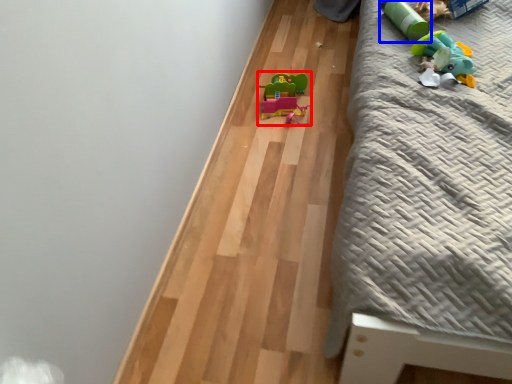
Question: Among these objects, which one is nearest to the camera, toy (highlighted by a red box) or toy (highlighted by a blue box)?

Choices:
 (A) toy
 (B) toy

Answer: (B)